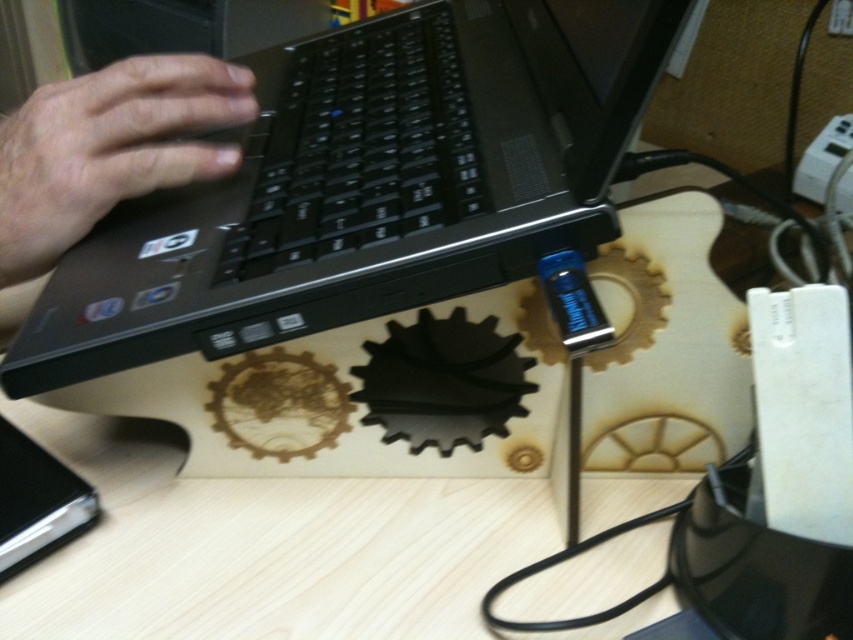
Who is positioned more to the left, black plastic laptop at center or skinny white hand at left?

skinny white hand at left

Consider the image. Which is below, black plastic laptop at center or skinny white hand at left?

skinny white hand at left is below.

In order to click on black plastic laptop at center in this screenshot , I will do `click(370, 188)`.

Does black matte keyboard at center come in front of skinny white hand at left?

Yes, black matte keyboard at center is closer to the viewer.

Is black matte keyboard at center to the left of skinny white hand at left from the viewer's perspective?

In fact, black matte keyboard at center is to the right of skinny white hand at left.

Who is more distant from viewer, (422, 77) or (236, 68)?

Positioned behind is point (422, 77).

Find the location of a particular element. black matte keyboard at center is located at coordinates (360, 147).

Is point (430, 108) positioned in front of point (292, 115)?

Yes.

Based on the photo, does black plastic laptop at center have a lesser height compared to black matte keyboard at center?

No, black plastic laptop at center is not shorter than black matte keyboard at center.

Describe the element at coordinates (370, 188) in the screenshot. The height and width of the screenshot is (640, 853). I see `black plastic laptop at center` at that location.

Locate an element on the screen. The height and width of the screenshot is (640, 853). black plastic laptop at center is located at coordinates (370, 188).